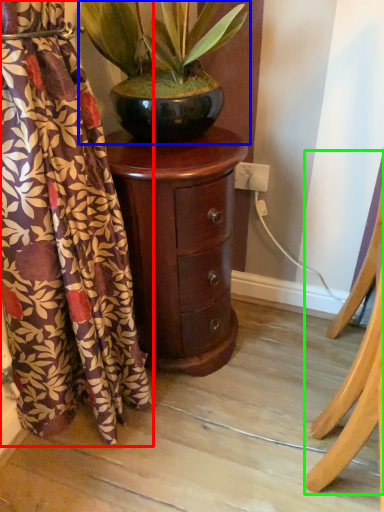
Question: Estimate the real-world distances between objects in this image. Which object is farther from curtain (highlighted by a red box), houseplant (highlighted by a blue box) or furniture (highlighted by a green box)?

Choices:
 (A) houseplant
 (B) furniture

Answer: (B)